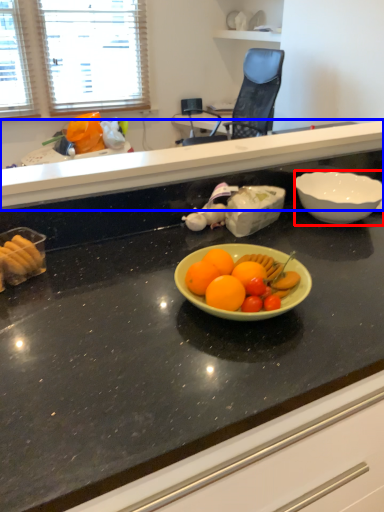
Question: Which object appears closest to the camera in this image, bowl (highlighted by a red box) or countertop (highlighted by a blue box)?

Choices:
 (A) bowl
 (B) countertop

Answer: (B)